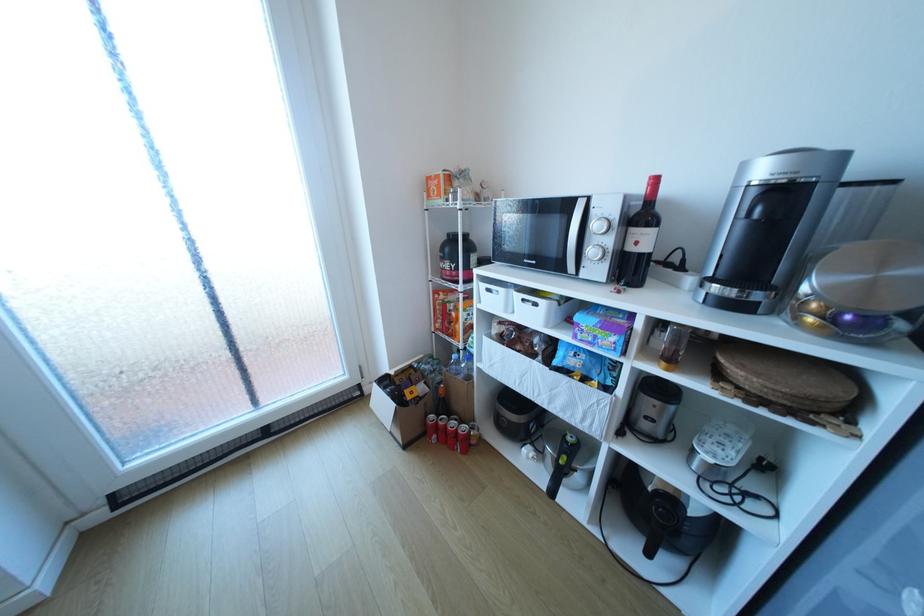
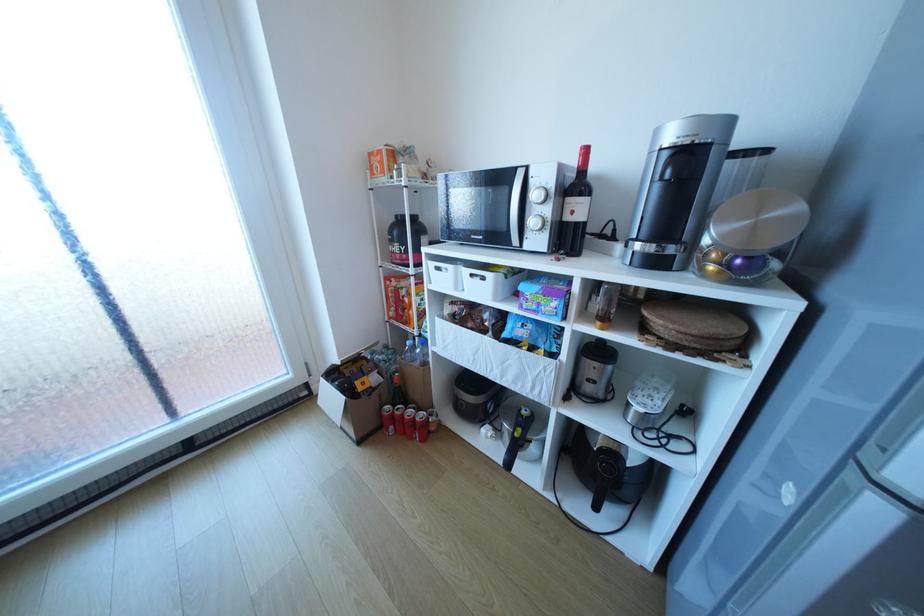
Find the pixel in the second image that matches the point at 600,251 in the first image.

(541, 222)